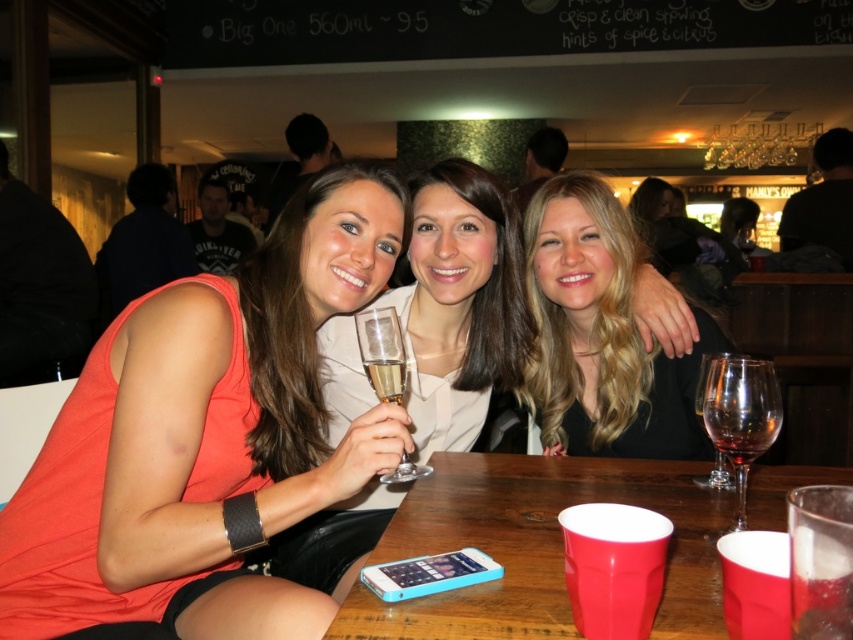
Who is higher up, transparent glass wine glass at right or transparent glass at table right?

transparent glass wine glass at right is higher up.

Does point (729, 396) come farther from viewer compared to point (695, 404)?

No, (729, 396) is closer to viewer.

Is point (735, 445) closer to viewer compared to point (709, 480)?

That is True.

Identify the location of transparent glass wine glass at right. This screenshot has width=853, height=640. (740, 419).

Who is taller, wooden table at center or clear glass wine glass at center?

clear glass wine glass at center is taller.

Where is `wooden table at center`? wooden table at center is located at coordinates (538, 547).

The width and height of the screenshot is (853, 640). I want to click on wooden table at center, so click(x=538, y=547).

Is matte orange tank top at center taller than transparent glass at table right?

Yes, matte orange tank top at center is taller than transparent glass at table right.

Which is in front, point (187, 392) or point (720, 470)?

Point (187, 392)

Who is more forward, (195, 369) or (698, 484)?

Point (195, 369) is more forward.

Where is `matte orange tank top at center`? Image resolution: width=853 pixels, height=640 pixels. matte orange tank top at center is located at coordinates (206, 438).